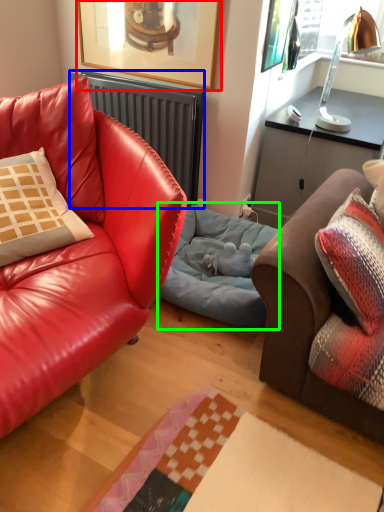
Question: Which object is positioned farthest from picture frame (highlighted by a red box)? Select from radiator (highlighted by a blue box) and dog bed (highlighted by a green box).

Choices:
 (A) radiator
 (B) dog bed

Answer: (B)